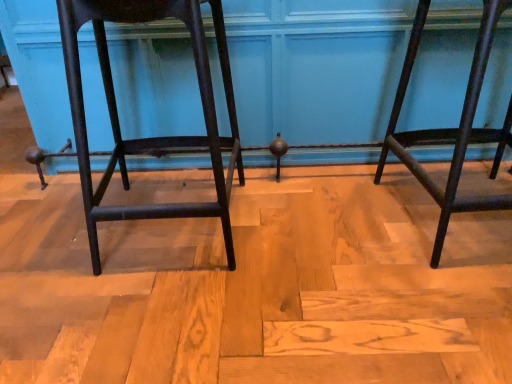
The width and height of the screenshot is (512, 384). In order to click on unoccupied area in front of matte black stool at left, which is the first furniture from left to right in this screenshot , I will do `click(165, 318)`.